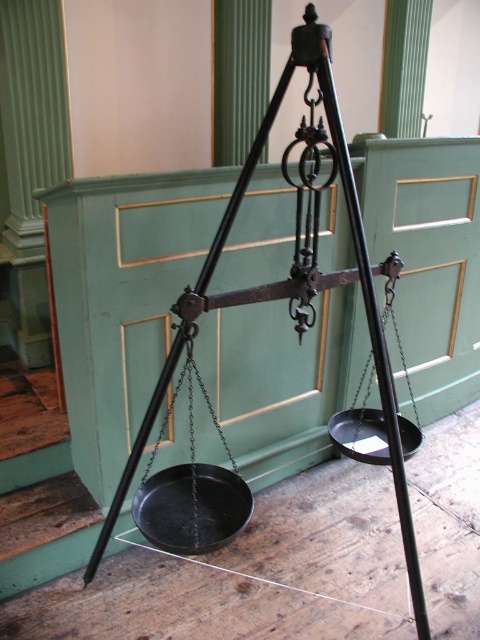
You are a merchant in an old market and need to place a heavy item on the scale. The black metal pan at right can hold up to 10 kilograms. Since the black matte scale at center is wider, does this mean it can hold more weight than the pan?

The black matte scale at center is wider than the black metal pan at right, but the scale itself is for measuring weight, not holding items. The pan is the part designed to hold the item, so the capacity remains up to 10 kilograms as stated.

You are standing in a room with an antique balance scale. You need to place a heavy object on one of the pans of the black metal tripod at center. Considering your height is 5 feet 6 inches, can you comfortably reach the pans without needing a stool?

The black metal tripod at center is 4.36 feet away from the viewer. Since the tripod is positioned close, and assuming the pans are at a typical height for such scales, someone 5 feet 6 inches tall might need to bend down slightly but could likely reach without a stool. However, exact reachability depends on the pans height which isn

You are a merchant in an old market and need to place a heavy sack of spices on the antique balance scale. The scale has two pans. Which object, the black metal tripod at center or the black matte scale at center, should you place the sack on to ensure it balances properly?

You should place the heavy sack of spices on the black matte scale at center because the black metal tripod at center is larger in size, meaning the scale itself is smaller and designed to hold the pans where the items are weighed.